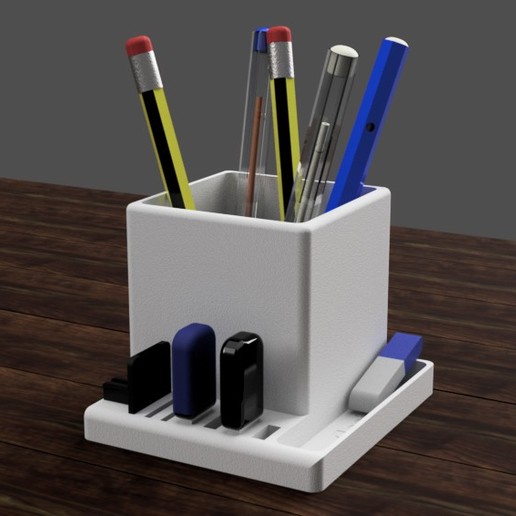
Identify the location of writing implements. pyautogui.click(x=150, y=70), pyautogui.click(x=261, y=75), pyautogui.click(x=278, y=64), pyautogui.click(x=330, y=87), pyautogui.click(x=391, y=75).